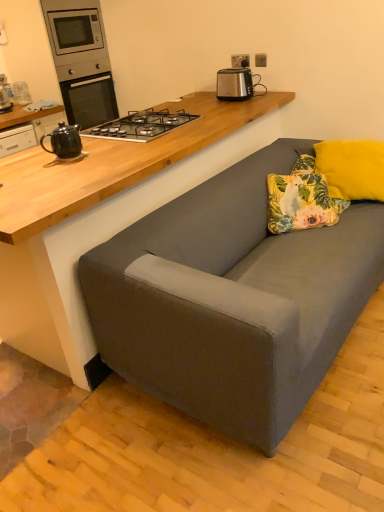
Question: In the image, is satin silver toaster at upper center on the left side or the right side of yellow fluffy pillow at upper right, arranged as the second pillow when viewed from the left?

Choices:
 (A) left
 (B) right

Answer: (A)

Question: Is point (240, 80) closer or farther from the camera than point (377, 147)?

Choices:
 (A) closer
 (B) farther

Answer: (B)

Question: Which is nearer to the black ceramic teapot at left?

Choices:
 (A) brushed metal microwave at upper left
 (B) floral fabric pillow at center, which is the 1th pillow from left to right
 (C) black metal/glass gas stove at upper center
 (D) satin silver toaster at upper center
 (E) yellow fluffy pillow at upper right, arranged as the second pillow when viewed from the left

Answer: (C)

Question: Estimate the real-world distances between objects in this image. Which object is closer to the brushed metal microwave at upper left?

Choices:
 (A) black ceramic teapot at left
 (B) floral fabric pillow at center, acting as the 2th pillow starting from the right
 (C) black metal/glass gas stove at upper center
 (D) satin silver toaster at upper center
 (E) yellow fluffy pillow at upper right, acting as the first pillow starting from the right

Answer: (C)